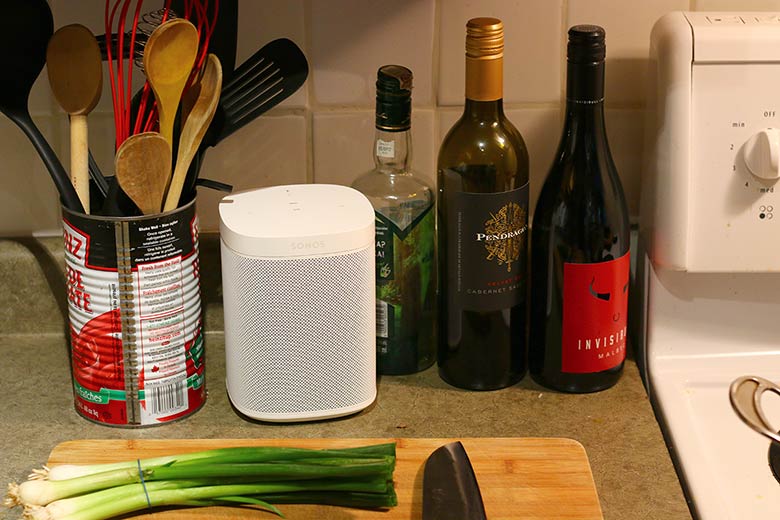
At what (x,y) coordinates should I click in order to perform the action: click on speaker. Please return your answer as a coordinate pair (x, y). The image size is (780, 520). Looking at the image, I should click on pos(309,322).